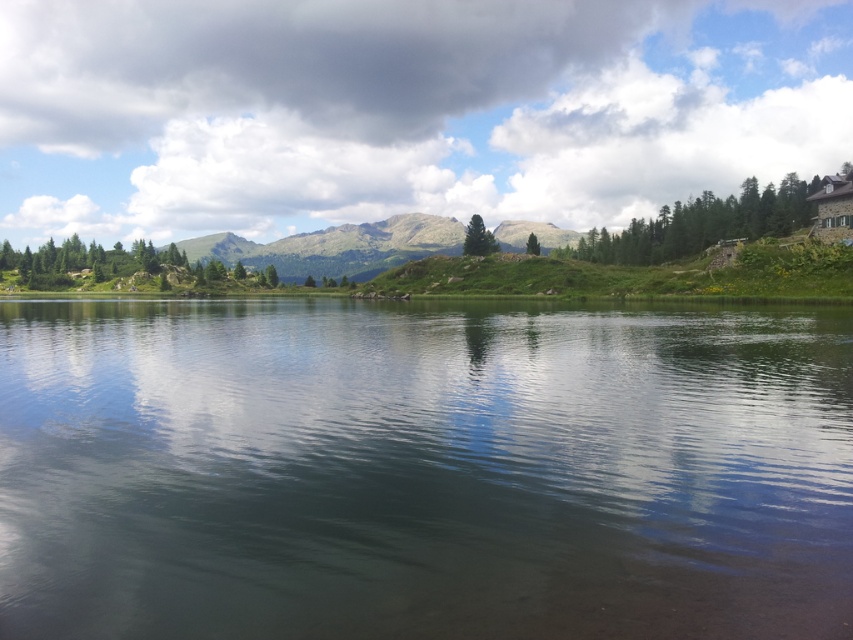
Can you confirm if clear water at center is taller than green grassy hill at center?

No.

Does point (363, 538) come closer to viewer compared to point (552, 230)?

Yes, it is.

I want to click on clear water at center, so click(421, 470).